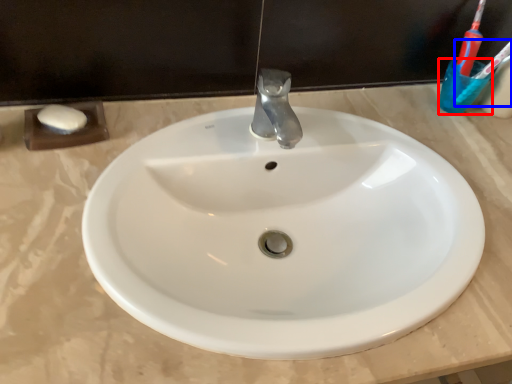
Question: Among these objects, which one is nearest to the camera, liquid (highlighted by a red box) or toothbrush (highlighted by a blue box)?

Choices:
 (A) liquid
 (B) toothbrush

Answer: (B)